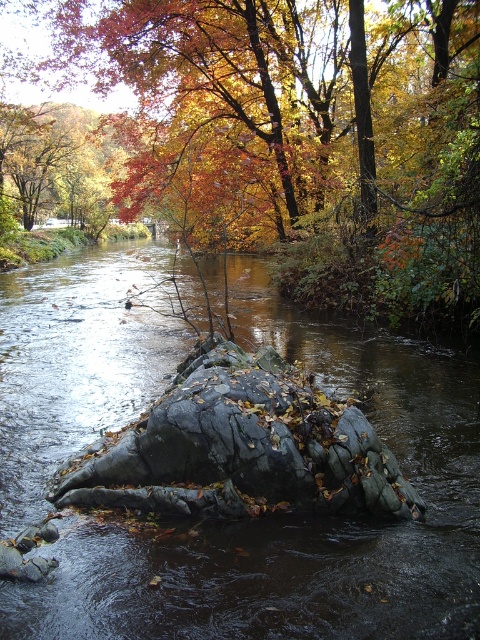
Question: Where is black rock at center located in relation to rough gray rock at center in the image?

Choices:
 (A) left
 (B) right

Answer: (A)

Question: Can you confirm if autumn leaves at center is positioned below rough gray rock at center?

Choices:
 (A) no
 (B) yes

Answer: (A)

Question: Which of the following is the closest to the observer?

Choices:
 (A) autumn leaves at center
 (B) black rock at center

Answer: (B)

Question: Which is nearer to the black rock at center?

Choices:
 (A) autumn leaves at center
 (B) rough gray rock at center

Answer: (B)

Question: Can you confirm if autumn leaves at center is wider than black rock at center?

Choices:
 (A) no
 (B) yes

Answer: (B)

Question: Which object is positioned closest to the black rock at center?

Choices:
 (A) autumn leaves at center
 (B) rough gray rock at center

Answer: (B)